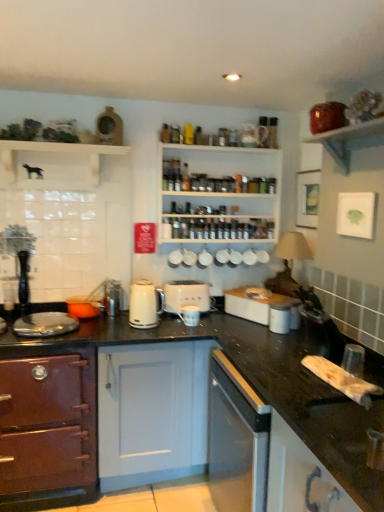
In order to click on vacant space in front of porcelain matte mug at center, marked as the third appliance in a left-to-right arrangement in this screenshot , I will do `click(191, 333)`.